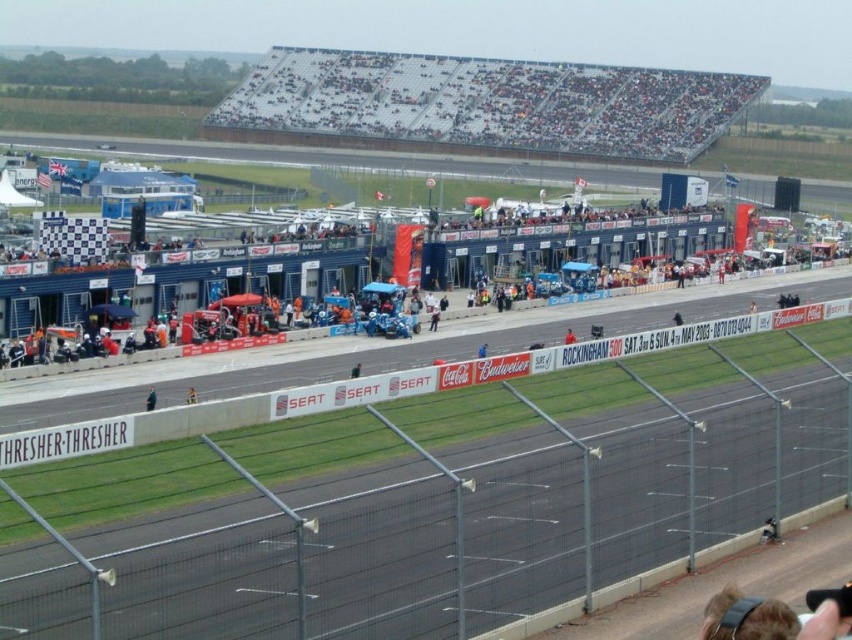
You are a spectator at the motorsport event and want to get a better view of the race. You notice the dark gray seats at upper center and the black fabric person at lower left. Which object is taller, allowing you to see over the fence?

The dark gray seats at upper center has a greater height compared to the black fabric person at lower left, so the dark gray seats at upper center would allow you to see over the fence better.

You are a spectator at the Rockingham Circuit motorsport event. You want to sit in the dark gray seats at upper center. Based on the scene description, where exactly are the dark gray seats located?

The dark gray seats at upper center are located at point coordinates of 0.164 on the x axis and 0.569 on the y axis.

You are a spectator at the Rockingham Circuit motorsport event. You notice the dark gray seats at upper center and the blue fabric person at center. From your vantage point, which object is closer to you?

The dark gray seats at upper center are closer to you because the blue fabric person at center is positioned behind them.